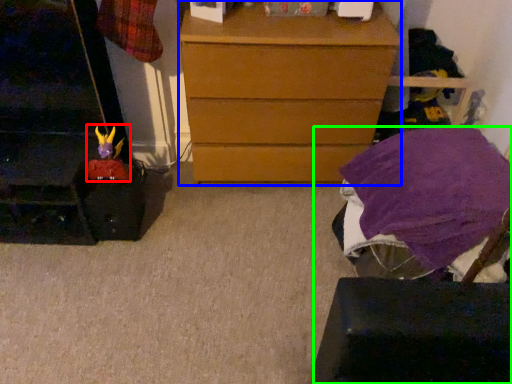
Question: Which object is the farthest from toy (highlighted by a red box)? Choose among these: chest of drawers (highlighted by a blue box) or furniture (highlighted by a green box).

Choices:
 (A) chest of drawers
 (B) furniture

Answer: (B)